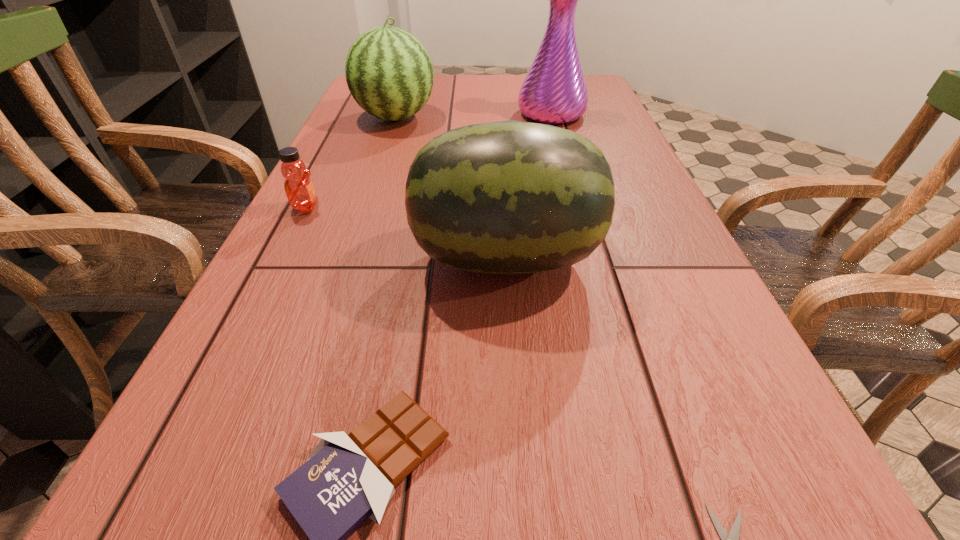
The width and height of the screenshot is (960, 540). Identify the location of free area in between the tallest object and the farther watermelon. (473, 116).

At what (x,y) coordinates should I click in order to perform the action: click on free space between the nearer watermelon and the third farthest object. Please return your answer as a coordinate pair (x, y). The image size is (960, 540). Looking at the image, I should click on (406, 233).

Where is `vacant space in between the vase and the farther watermelon`? vacant space in between the vase and the farther watermelon is located at coordinates (473, 116).

This screenshot has height=540, width=960. I want to click on object that stands as the third closest to the farther watermelon, so click(510, 197).

Point out which object is positioned as the fourth nearest to the shortest object. Please provide its 2D coordinates. Your answer should be formatted as a tuple, i.e. [(x, y)], where the tuple contains the x and y coordinates of a point satisfying the conditions above.

[(554, 91)]